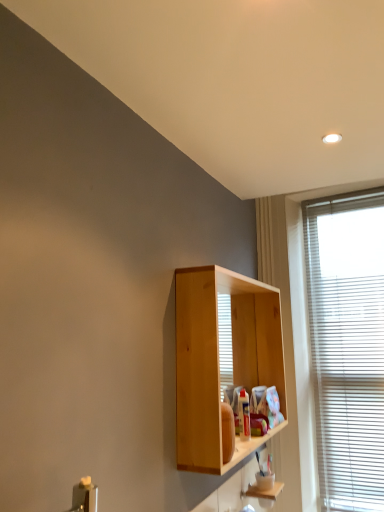
Question: In terms of height, does white blinds at right look taller or shorter compared to wooden shelf at lower center?

Choices:
 (A) short
 (B) tall

Answer: (B)

Question: In the image, is white blinds at right positioned in front of or behind wooden shelf at lower center?

Choices:
 (A) front
 (B) behind

Answer: (B)

Question: Which is nearer to the wooden cabinet at lower right?

Choices:
 (A) natural wood cabinet at center
 (B) white blinds at right
 (C) wooden shelf at lower center

Answer: (C)

Question: Which is nearer to the natural wood cabinet at center?

Choices:
 (A) wooden cabinet at lower right
 (B) wooden shelf at lower center
 (C) white blinds at right

Answer: (C)